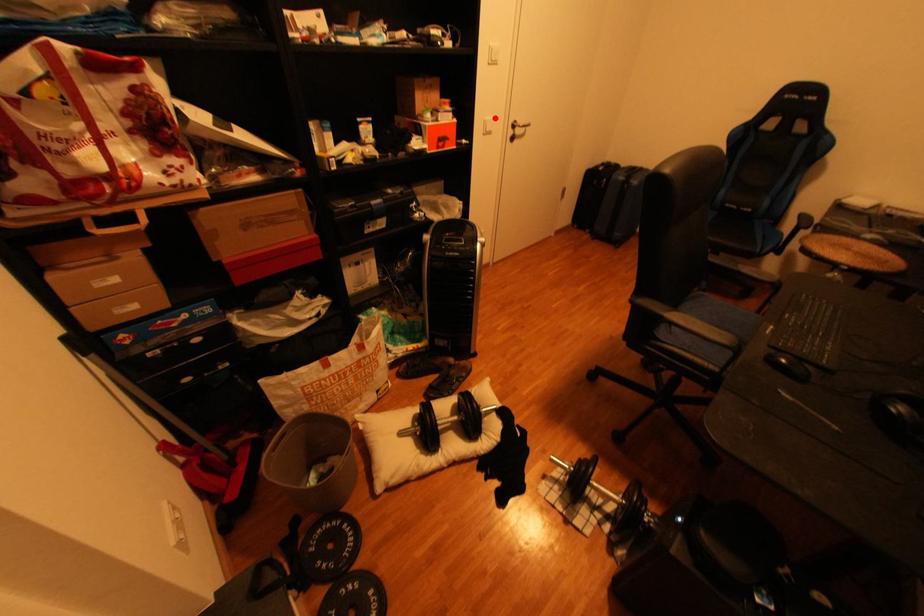
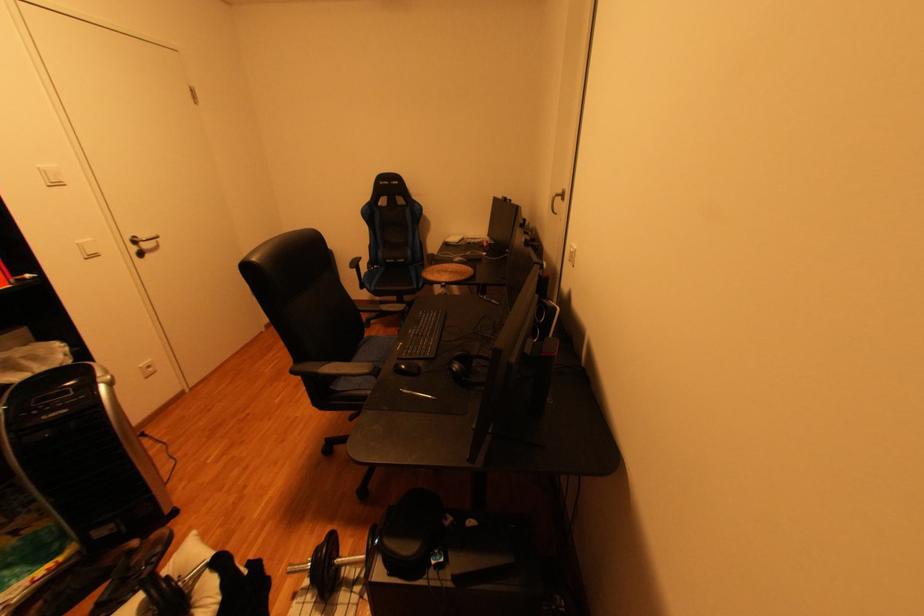
Find the pixel in the second image that matches the highlighted location in the first image.

(89, 243)